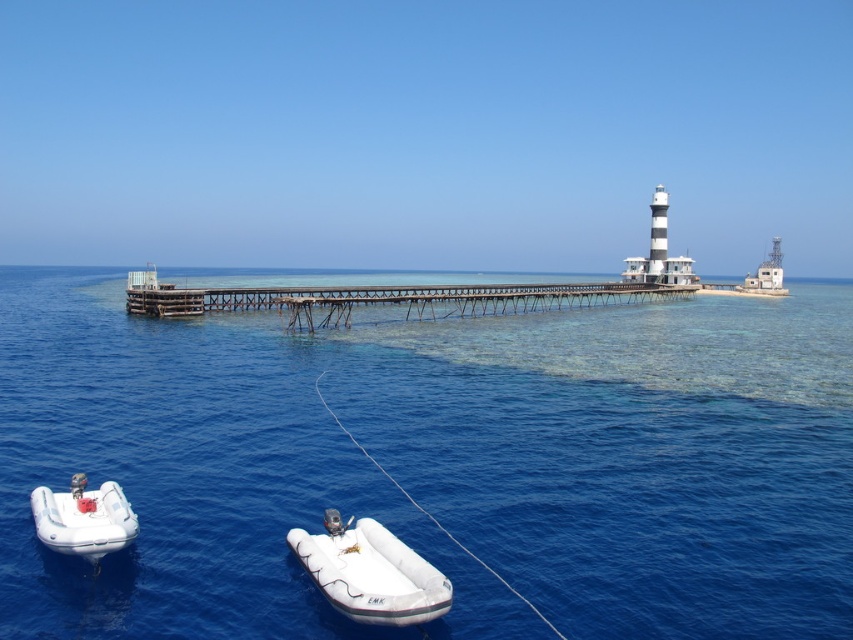
You are a sailor planning to navigate between the blue clear water at center and the white rubber boat at lower center. Which direction should you steer to reach the boat from the water?

The blue clear water at center is positioned on the left side of white rubber boat at lower center, so you should steer to the right to reach the boat from the water.

You are a sailor who needs to secure your boat to a dock. You have a white rubber dinghy at lower left and see the rusty metal dock at center. Which dock can you tie your dinghy to based on their sizes?

The rusty metal dock at center has a larger size compared to the white rubber dinghy at lower left, so it is suitable to tie the dinghy to the rusty metal dock at center.

You are a sailor who needs to reach the white rubber boat at lower center from the rusty metal dock at center. Given that your speed is 10 feet per second, how many seconds will it take you to swim to the boat?

The distance between the rusty metal dock at center and the white rubber boat at lower center is 286.76 feet. At a swimming speed of 10 feet per second, it would take approximately 28.68 seconds to reach the boat.